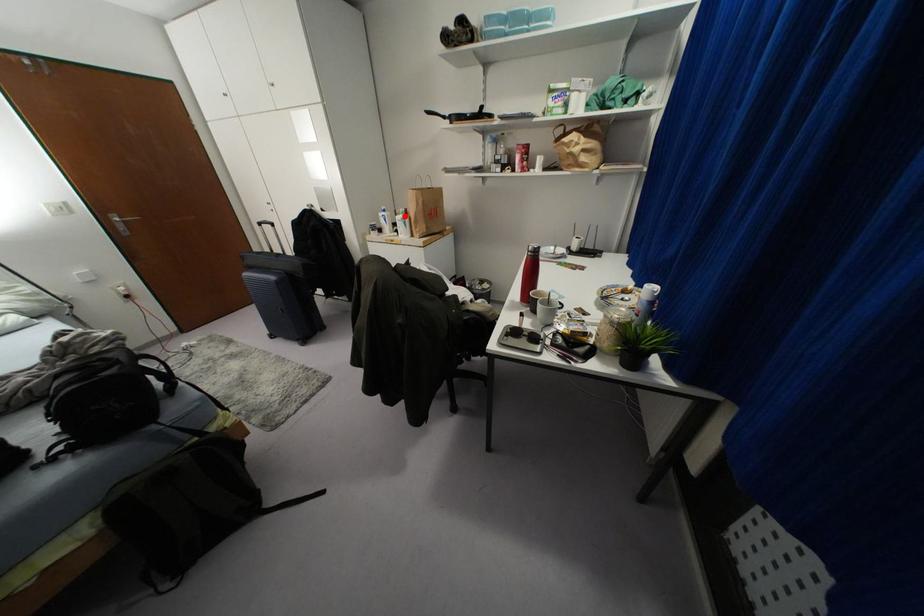
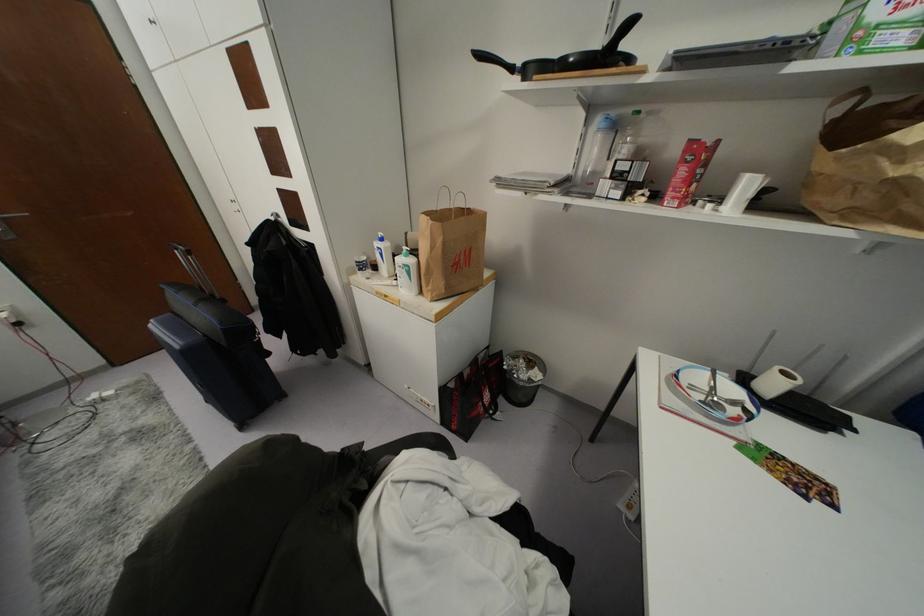
The point at the highlighted location is marked in the first image. Where is the corresponding point in the second image?

(410, 261)